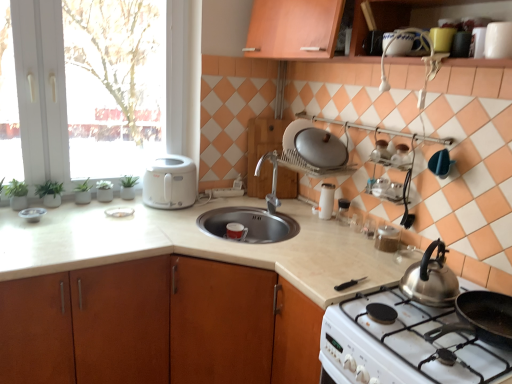
The height and width of the screenshot is (384, 512). Identify the location of free space in front of white glossy salt shaker at center, placed as the 1th kitchen appliance when sorted from right to left. (326, 223).